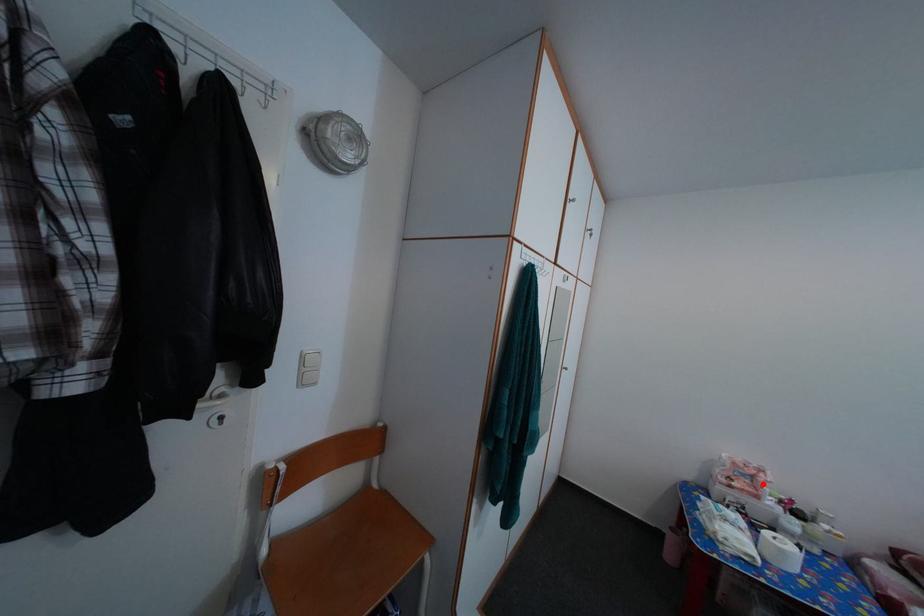
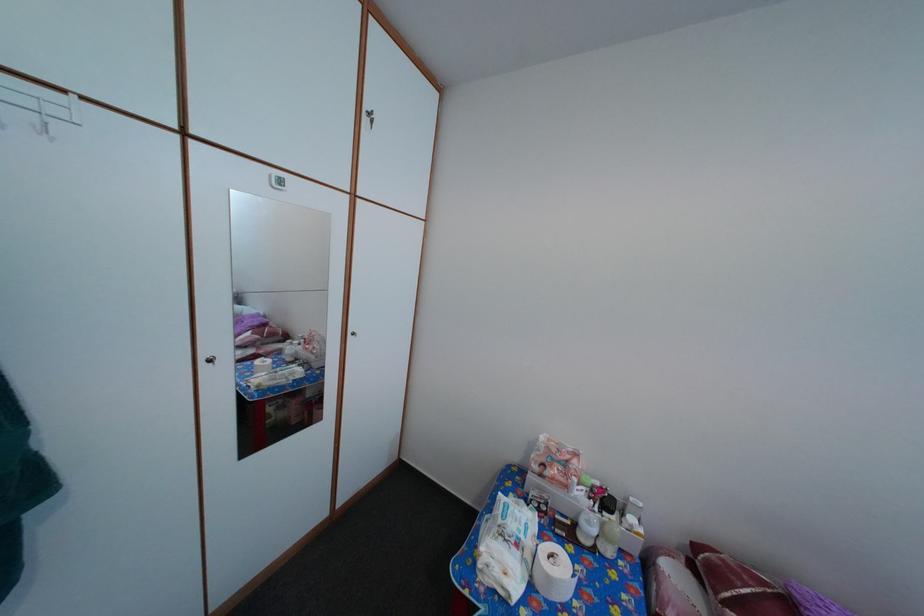
Where in the second image is the point corresponding to the highlighted location from the first image?

(576, 469)